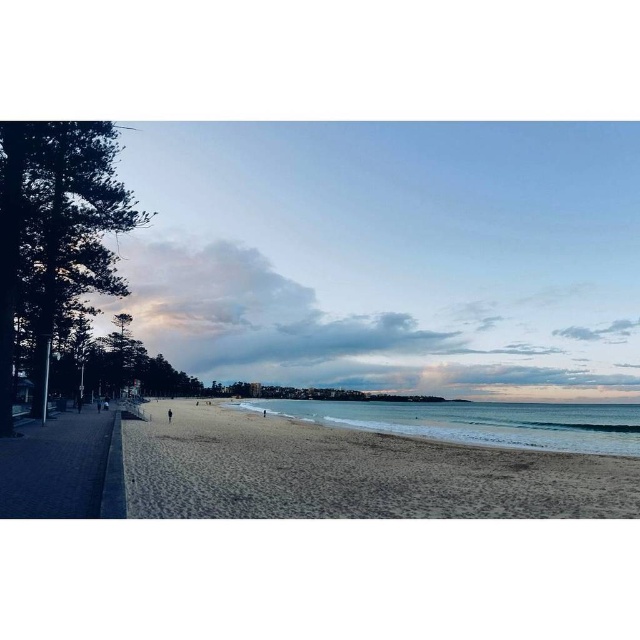
Question: Which object appears closest to the camera in this image?

Choices:
 (A) beige sandy beach at center
 (B) blue water at lower center

Answer: (A)

Question: Considering the relative positions of beige sandy beach at center and blue water at lower center in the image provided, where is beige sandy beach at center located with respect to blue water at lower center?

Choices:
 (A) below
 (B) above

Answer: (B)

Question: Which point is closer to the camera?

Choices:
 (A) (154, 413)
 (B) (460, 413)

Answer: (A)

Question: Which point appears farthest from the camera in this image?

Choices:
 (A) (426, 438)
 (B) (403, 426)

Answer: (B)

Question: Does beige sandy beach at center have a lesser width compared to blue water at lower center?

Choices:
 (A) yes
 (B) no

Answer: (A)

Question: Can you confirm if beige sandy beach at center is wider than blue water at lower center?

Choices:
 (A) no
 (B) yes

Answer: (A)